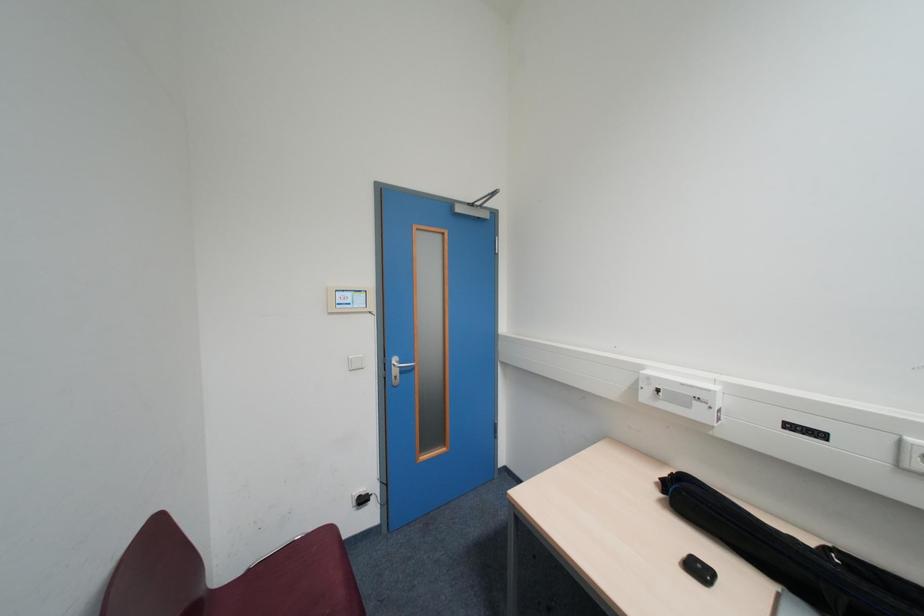
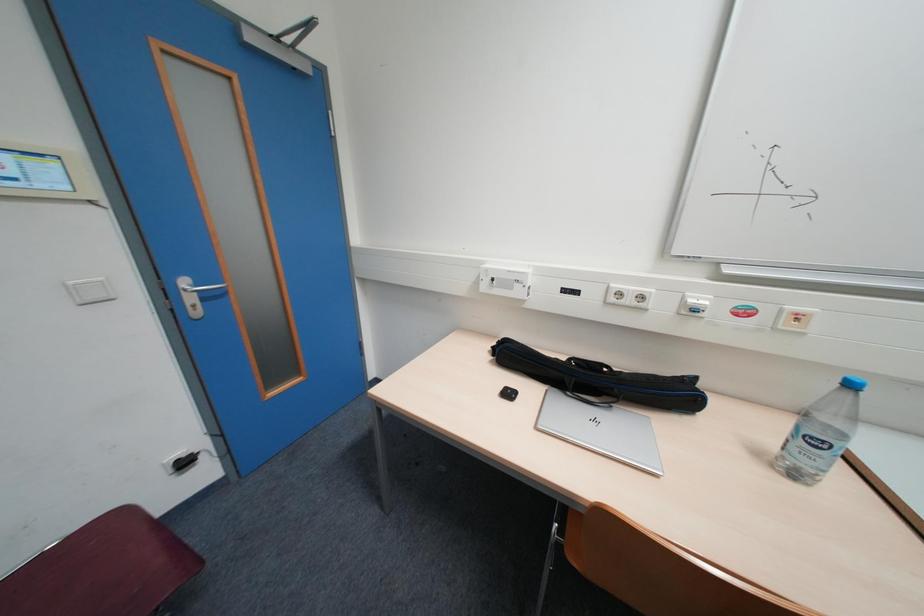
The first image is from the beginning of the video and the second image is from the end. How did the camera likely rotate when shooting the video?

The camera's rotation is toward right-down.